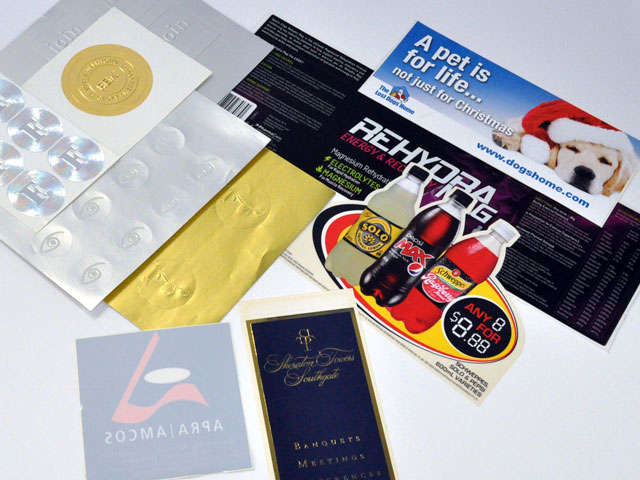
Locate an element on the screen. white table is located at coordinates (518, 440).